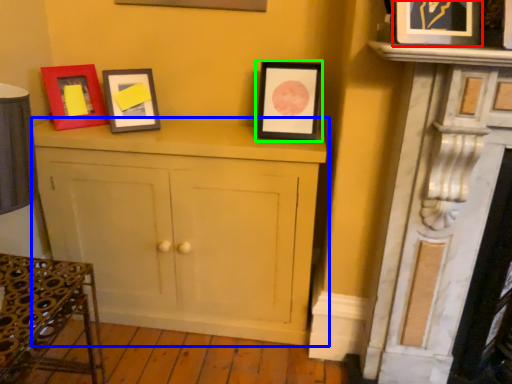
Question: Which is nearer to the picture frame (highlighted by a red box)? cabinetry (highlighted by a blue box) or picture frame (highlighted by a green box).

Choices:
 (A) cabinetry
 (B) picture frame

Answer: (B)